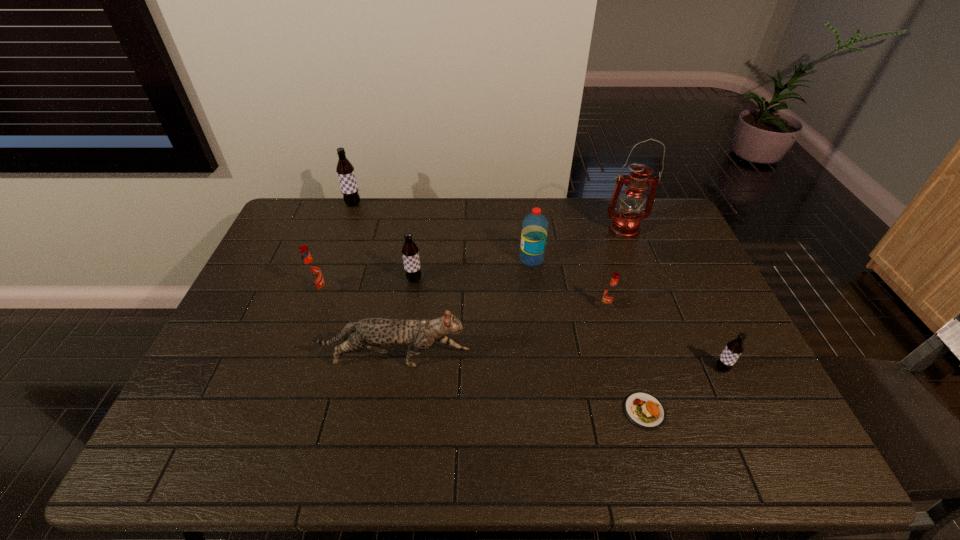
Locate an element on the screen. cat is located at coordinates (419, 335).

Where is `the fourth root beer from left to right`? The width and height of the screenshot is (960, 540). the fourth root beer from left to right is located at coordinates (610, 295).

The width and height of the screenshot is (960, 540). Identify the location of the right red root beer. (610, 295).

Find the location of a particular element. the nearest root beer is located at coordinates [x=734, y=348].

Identify the location of the rightmost object. (734, 348).

What are the coordinates of `patty (food)` in the screenshot? It's located at (645, 411).

What are the coordinates of `the shortest object` in the screenshot? It's located at (645, 411).

At what (x,y) coordinates should I click in order to perform the action: click on free region located 0.090m on the back of the second farthest object. Please return your answer as a coordinate pair (x, y). Looking at the image, I should click on (614, 206).

This screenshot has width=960, height=540. Find the location of `free space located 0.250m on the right of the leftmost brown root beer`. free space located 0.250m on the right of the leftmost brown root beer is located at coordinates (429, 204).

At what (x,y) coordinates should I click in order to perform the action: click on free space located 0.290m on the front label of the seventh nearest object. Please return your answer as a coordinate pair (x, y). This screenshot has height=540, width=960. Looking at the image, I should click on (430, 259).